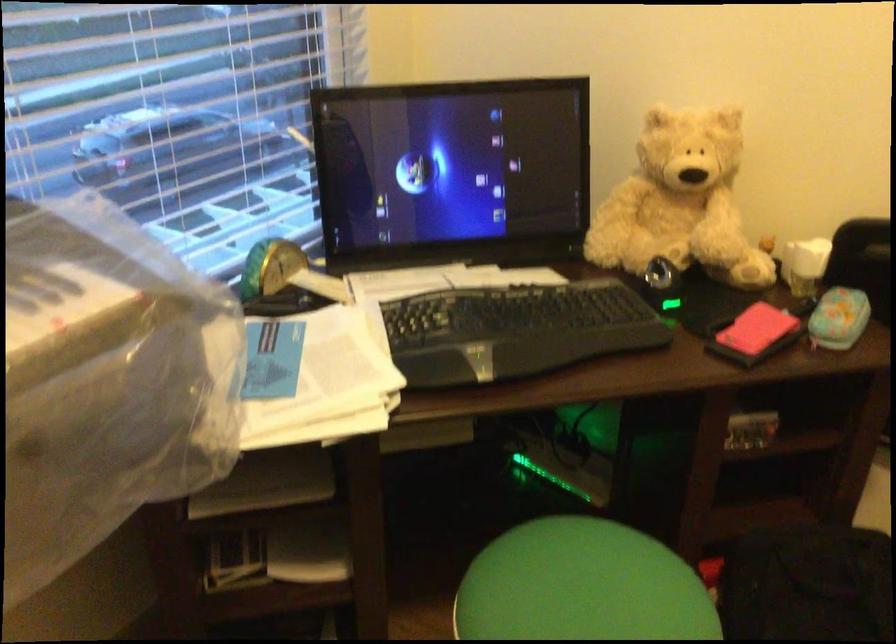
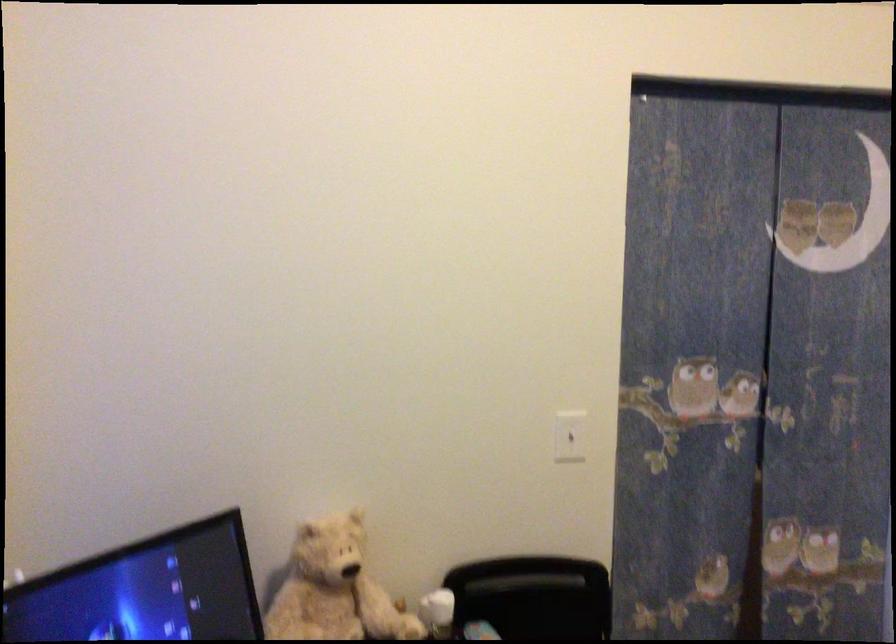
The point at (690, 187) is marked in the first image. Where is the corresponding point in the second image?

(334, 589)